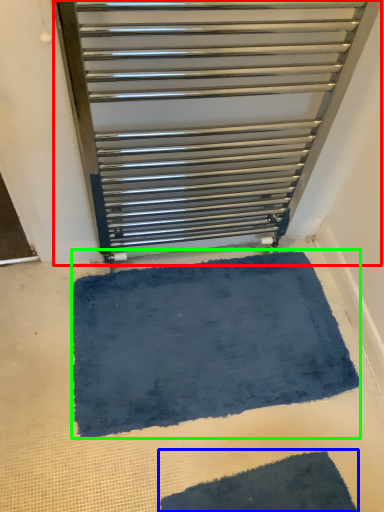
Question: Which object is the closest to the furniture (highlighted by a red box)? Choose among these: bath mat (highlighted by a blue box) or bath mat (highlighted by a green box).

Choices:
 (A) bath mat
 (B) bath mat

Answer: (B)